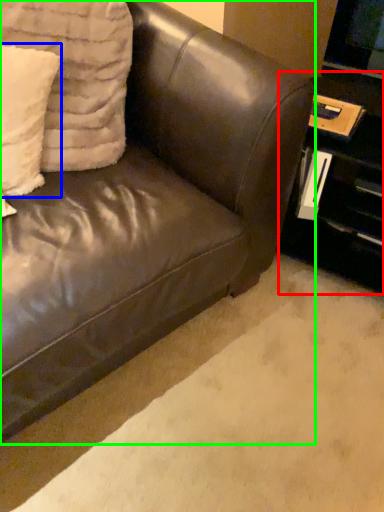
Question: Estimate the real-world distances between objects in this image. Which object is closer to table (highlighted by a red box), pillow (highlighted by a blue box) or studio couch (highlighted by a green box)?

Choices:
 (A) pillow
 (B) studio couch

Answer: (B)